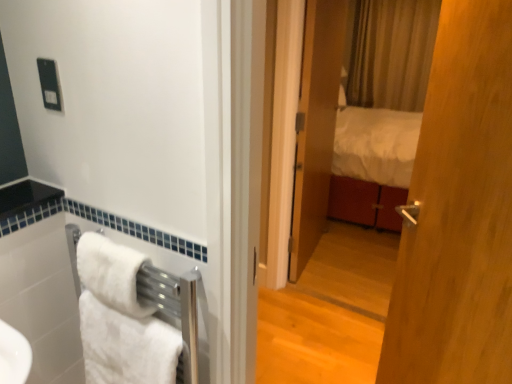
In order to click on free space in front of matte wooden mirror at center in this screenshot , I will do `click(330, 341)`.